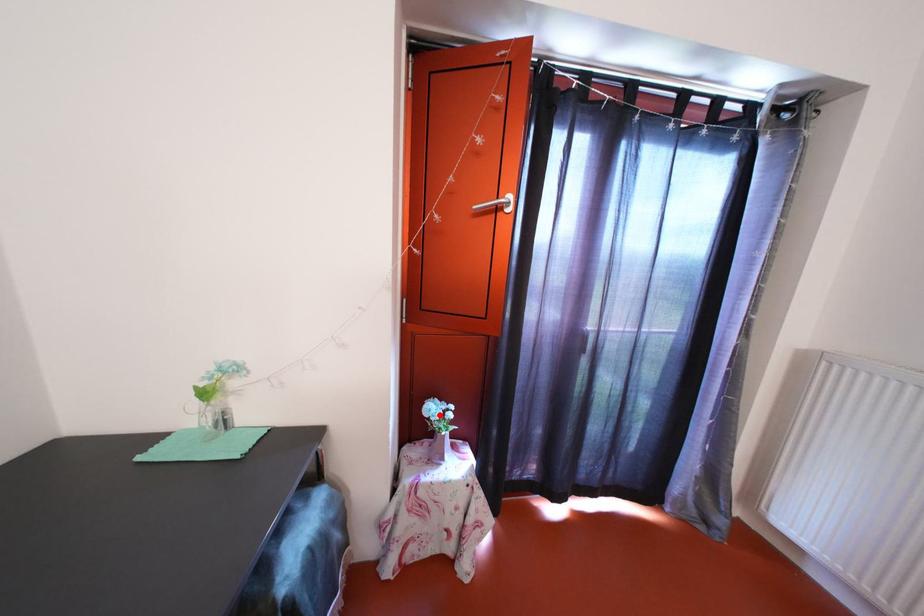
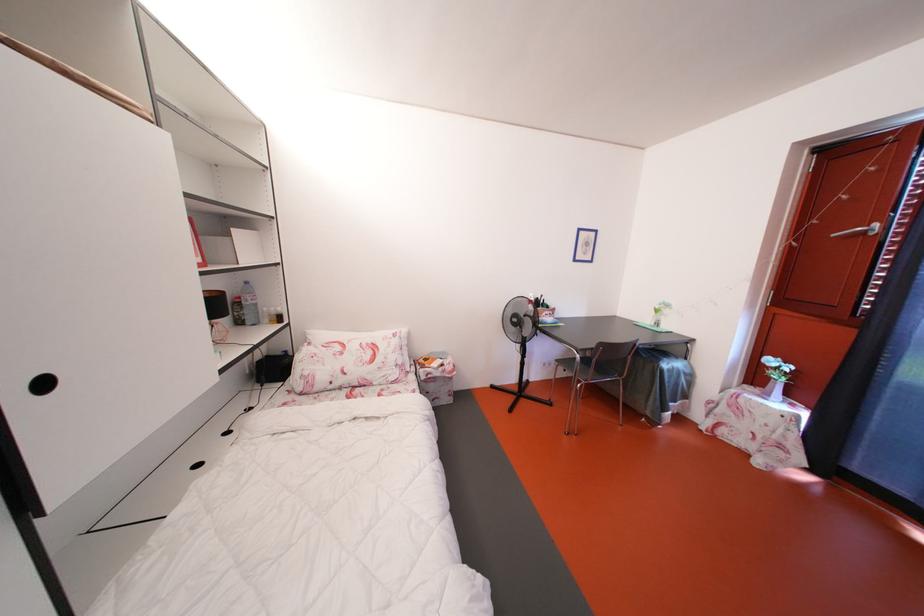
Find the pixel in the second image that matches the highlighted location in the first image.

(779, 367)